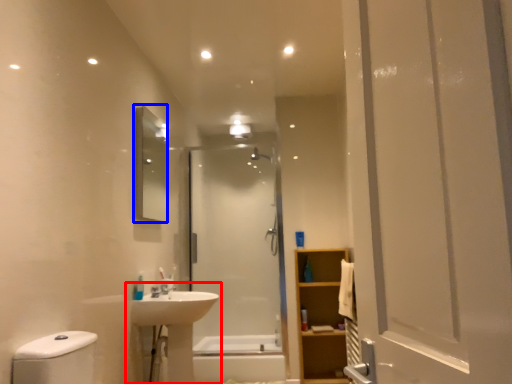
Question: Which of the following is the closest to the observer, sink (highlighted by a red box) or mirror (highlighted by a blue box)?

Choices:
 (A) sink
 (B) mirror

Answer: (A)